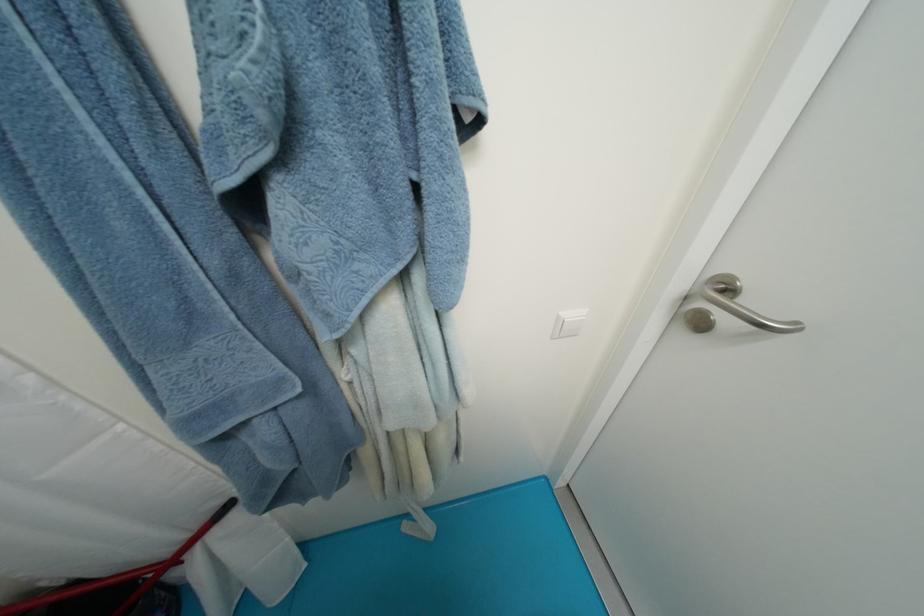
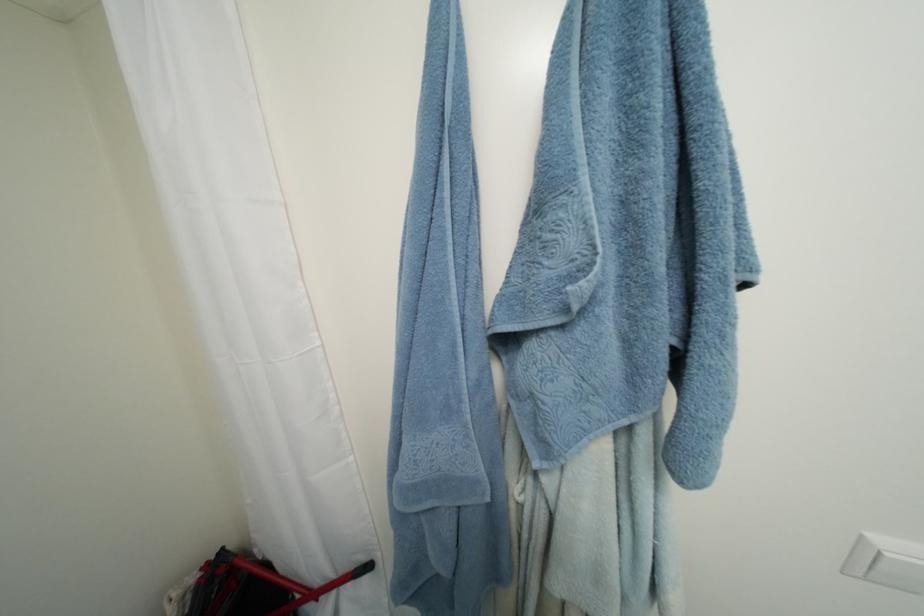
In the second image, find the point that corresponds to [567,331] in the first image.

(880, 570)